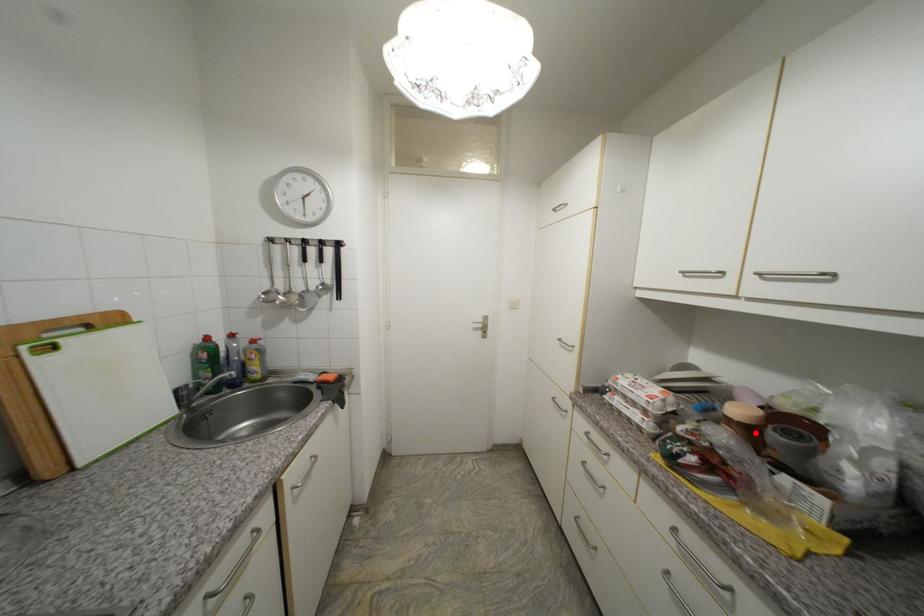
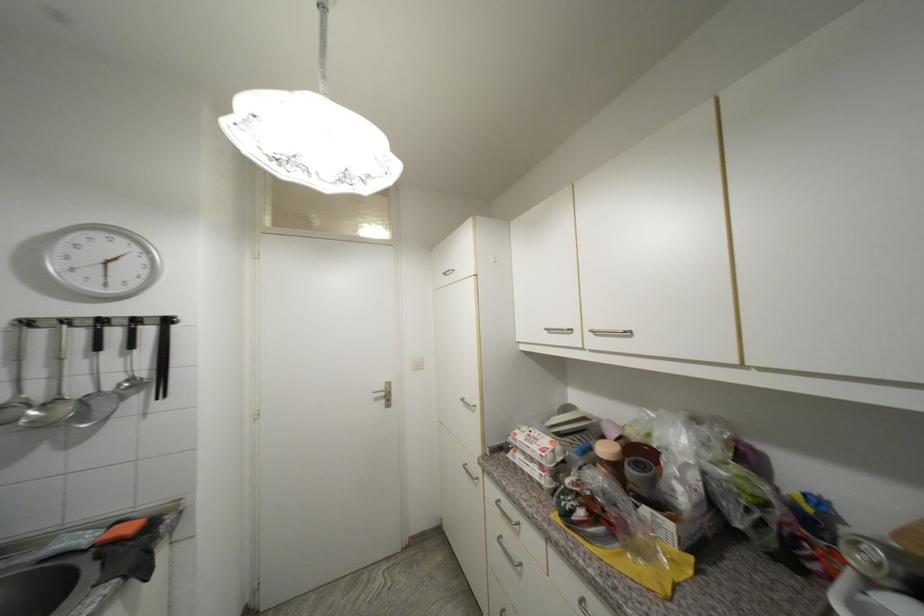
The point at the highlighted location is marked in the first image. Where is the corresponding point in the second image?

(622, 469)